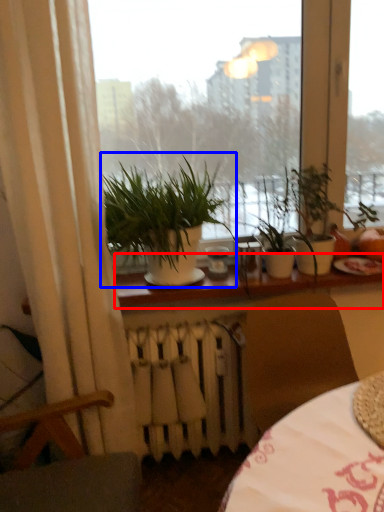
Question: Which object is closer to the camera taking this photo, window sill (highlighted by a red box) or houseplant (highlighted by a blue box)?

Choices:
 (A) window sill
 (B) houseplant

Answer: (B)